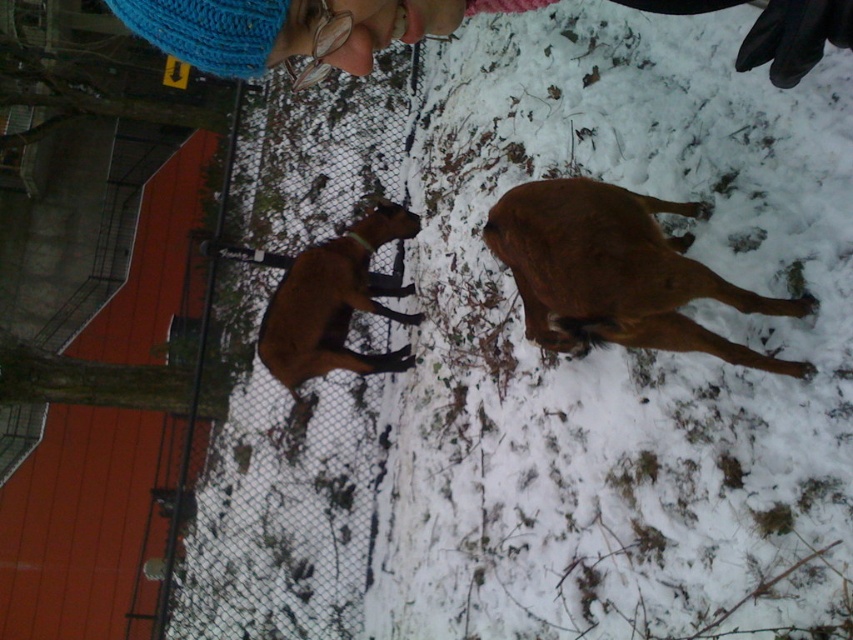
Question: Which of the following is the farthest from the observer?

Choices:
 (A) (595, 237)
 (B) (370, 308)

Answer: (B)

Question: Can you confirm if metal mesh fence at lower left is positioned below brown matte dog at center?

Choices:
 (A) yes
 (B) no

Answer: (B)

Question: Is metal mesh fence at lower left bigger than brown matte dog at center?

Choices:
 (A) no
 (B) yes

Answer: (A)

Question: Which of the following is the closest to the observer?

Choices:
 (A) (347, 253)
 (B) (206, 38)
 (C) (352, 410)
 (D) (585, 180)

Answer: (B)

Question: Which point is farther to the camera?

Choices:
 (A) (334, 518)
 (B) (338, 330)
 (C) (556, 348)

Answer: (A)

Question: Can you confirm if brown furry dog at center is positioned to the right of brown matte dog at center?

Choices:
 (A) yes
 (B) no

Answer: (A)